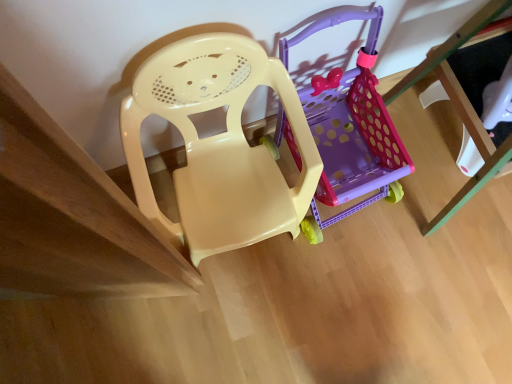
Question: Is point (221, 201) positioned closer to the camera than point (372, 132)?

Choices:
 (A) closer
 (B) farther

Answer: (A)

Question: In terms of size, does matte plastic chair at center appear bigger or smaller than translucent purple plastic shopping cart at center?

Choices:
 (A) small
 (B) big

Answer: (B)

Question: From a real-world perspective, relative to translucent purple plastic shopping cart at center, is matte plastic chair at center vertically above or below?

Choices:
 (A) above
 (B) below

Answer: (A)

Question: Considering the positions of point (311, 92) and point (287, 82), is point (311, 92) closer or farther from the camera than point (287, 82)?

Choices:
 (A) closer
 (B) farther

Answer: (B)

Question: Is translucent purple plastic shopping cart at center in front of or behind matte plastic chair at center in the image?

Choices:
 (A) behind
 (B) front

Answer: (A)

Question: Is translucent purple plastic shopping cart at center bigger or smaller than matte plastic chair at center?

Choices:
 (A) small
 (B) big

Answer: (A)

Question: Is translucent purple plastic shopping cart at center taller or shorter than matte plastic chair at center?

Choices:
 (A) short
 (B) tall

Answer: (A)